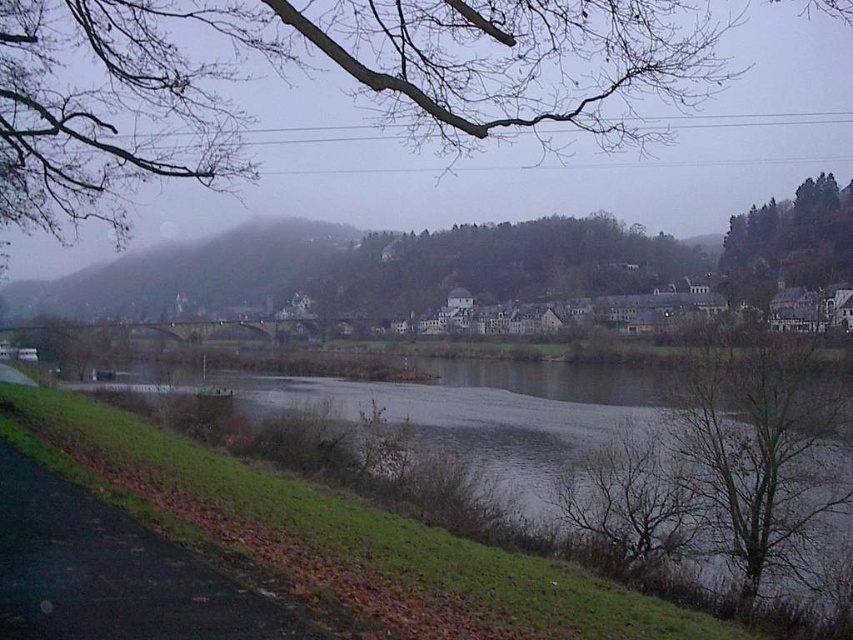
You are a photographer standing at the riverside. You want to capture a photo that includes both the bare branches at upper center and the gray smooth water at lower left. Given that your camera can focus on objects up to 20 meters away, will both elements be in focus?

The bare branches at upper center is 17.65 meters away from gray smooth water at lower left. Since the maximum focusing distance is 20 meters, both elements will be within the camera focus range and thus in focus.

You are an artist sketching the riverside scene. You need to decide which object to draw first based on their sizes. Which one should you start with, the bare branches at lower right or the green leafy tree at upper right?

You should start with the green leafy tree at upper right because it is larger than the bare branches at lower right, making it a foundational element in the composition.

You are standing at the camera position and want to reach both the point at coordinates (770, 429) and the point at coordinates (850, 280). Which point will you reach first?

You will reach the point at coordinates (770, 429) first because it is closer to the camera than the point at coordinates (850, 280).